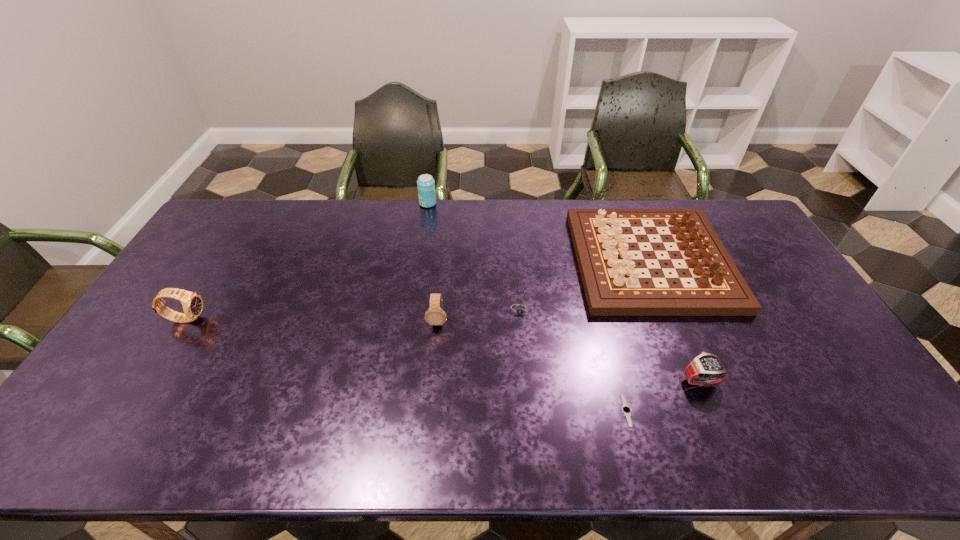
This screenshot has width=960, height=540. Find the location of `the fifth closest watch to the farthest object`. the fifth closest watch to the farthest object is located at coordinates (706, 369).

At what (x,y) coordinates should I click in order to perform the action: click on vacant space that satisfies the following two spatial constraints: 1. on the face of the second watch from right to left; 2. on the left side of the fourth watch from right to left. Please return your answer as a coordinate pair (x, y). The image size is (960, 540). Looking at the image, I should click on (429, 411).

Find the location of a particular element. This screenshot has height=540, width=960. vacant position in the image that satisfies the following two spatial constraints: 1. on the face of the second shortest object; 2. on the left side of the second watch from right to left is located at coordinates (529, 411).

This screenshot has width=960, height=540. I want to click on free spot that satisfies the following two spatial constraints: 1. on the back side of the shortest object; 2. on the face of the leftmost object, so click(x=602, y=318).

I want to click on vacant area that satisfies the following two spatial constraints: 1. on the face of the fourth watch from right to left; 2. on the right side of the third shortest object, so click(432, 380).

Find the location of a particular element. vacant position in the image that satisfies the following two spatial constraints: 1. on the face of the leftmost watch; 2. on the right side of the rightmost watch is located at coordinates (148, 380).

Where is `vacant space that satisfies the following two spatial constraints: 1. on the front side of the sixth object from right to left; 2. on the face of the leftmost object`? vacant space that satisfies the following two spatial constraints: 1. on the front side of the sixth object from right to left; 2. on the face of the leftmost object is located at coordinates (411, 318).

Locate an element on the screen. This screenshot has height=540, width=960. vacant position in the image that satisfies the following two spatial constraints: 1. on the front side of the shortest watch; 2. on the right side of the sixth object from right to left is located at coordinates (397, 411).

In order to click on free space in the image that satisfies the following two spatial constraints: 1. on the face of the leftmost object; 2. on the back side of the nearest object in this screenshot , I will do `click(128, 411)`.